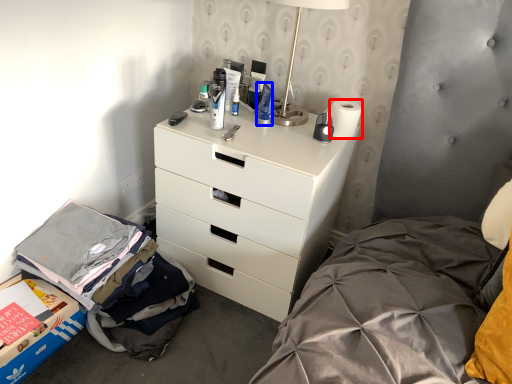
Question: Which object appears closest to the camera in this image, toilet paper (highlighted by a red box) or toiletry (highlighted by a blue box)?

Choices:
 (A) toilet paper
 (B) toiletry

Answer: (B)